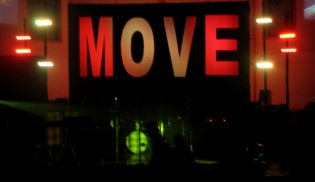
The image size is (315, 182). What are the coordinates of `yellow/green light` in the screenshot? It's located at (45, 24), (43, 65), (262, 65), (267, 20).